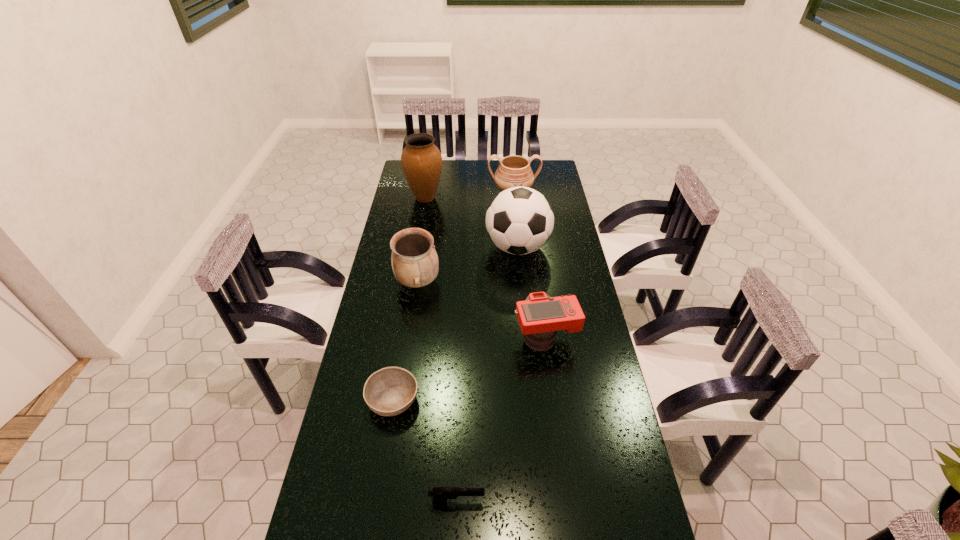
The height and width of the screenshot is (540, 960). Find the location of `urn present at the right edge`. urn present at the right edge is located at coordinates (514, 171).

Locate an element on the screen. camera that is positioned at the right edge is located at coordinates (540, 316).

I want to click on object present at the far right corner, so click(x=514, y=171).

In order to click on vacant point at the far edge in this screenshot , I will do `click(454, 164)`.

Locate an element on the screen. The width and height of the screenshot is (960, 540). free space at the left edge is located at coordinates (374, 355).

In the image, there is a desktop. At what (x,y) coordinates should I click in order to perform the action: click on vacant space at the right edge. Please return your answer as a coordinate pair (x, y). The height and width of the screenshot is (540, 960). Looking at the image, I should click on (602, 380).

Locate an element on the screen. This screenshot has width=960, height=540. free point between the fifth farthest object and the soccer ball is located at coordinates (531, 293).

Identify the location of vacant point located between the soccer ball and the nearest urn. Image resolution: width=960 pixels, height=540 pixels. [468, 265].

The width and height of the screenshot is (960, 540). In order to click on empty space between the tallest urn and the rightmost urn in this screenshot , I will do `click(469, 196)`.

Locate an element on the screen. unoccupied position between the tallest urn and the third shortest object is located at coordinates (485, 268).